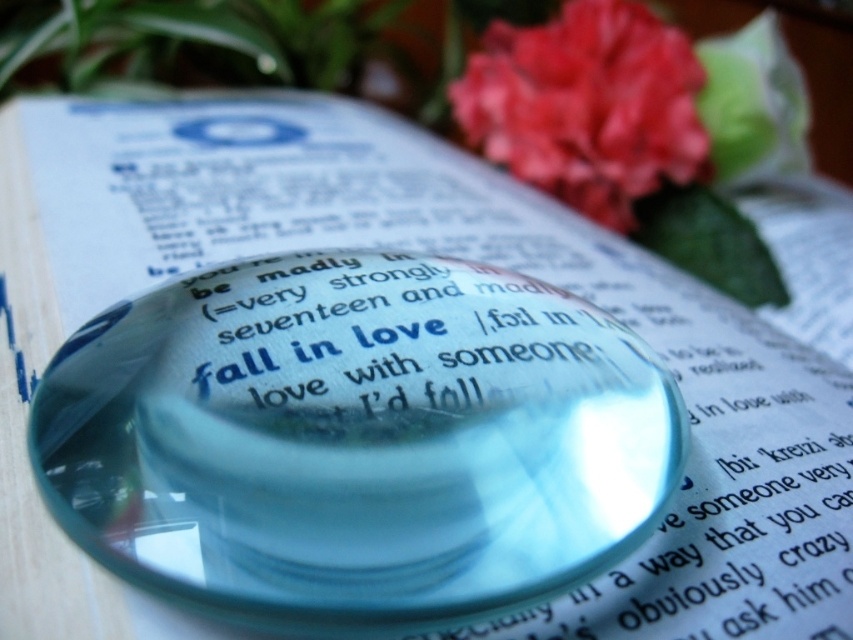
You are a photographer trying to capture the vivid red petals at upper right in your shot. The transparent glass magnifying glass at center is blocking part of the petals. Can you move the magnifying glass to the right to get a clearer view of the petals?

The transparent glass magnifying glass at center is positioned on the left side of the vivid red petals at upper right, so moving it to the right would allow you to see more of the petals without obstruction.

In the scene shown: You are a photographer trying to capture the text under the transparent glass magnifying glass at center. However, the vivid red petals at upper right are blocking your view. Can you move the petals to the side to get a clear shot of the text?

The transparent glass magnifying glass at center is in front of vivid red petals at upper right, so the petals are behind the magnifying glass and not blocking the view. You don not need to move them.